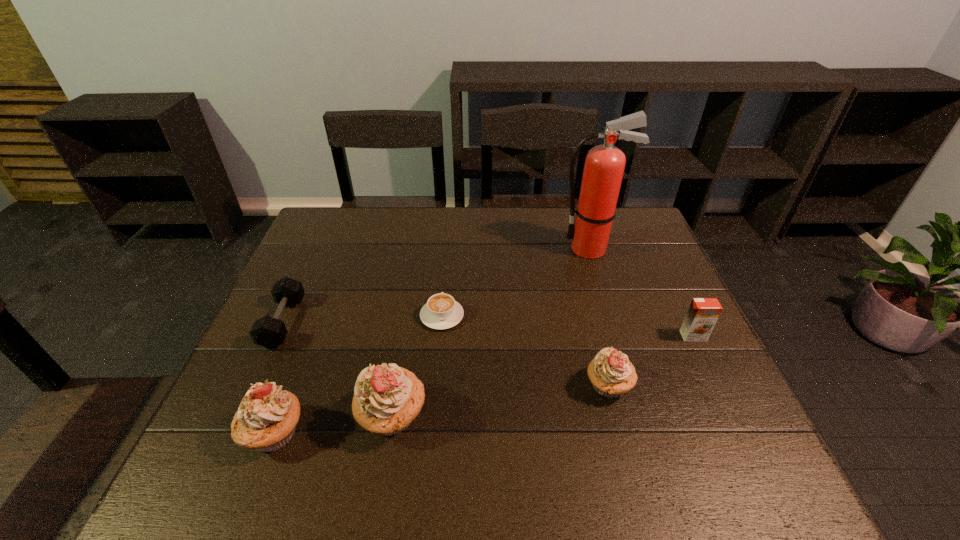
If equal spacing is the goal by inserting an additional cupcake among them, please point out a vacant space for this new cupcake. Please provide its 2D coordinates. Your answer should be formatted as a tuple, i.e. [(x, y)], where the tuple contains the x and y coordinates of a point satisfying the conditions above.

[(504, 400)]